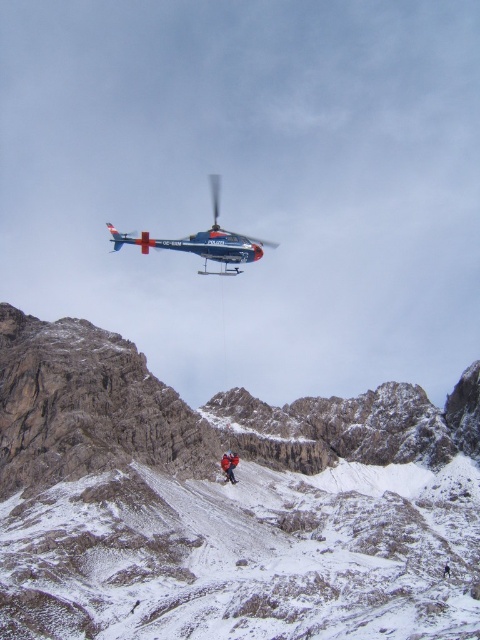
Question: Which point is farther from the camera taking this photo?

Choices:
 (A) (233, 477)
 (B) (238, 262)

Answer: (B)

Question: Which object is the farthest from the snowy rocky mountain at center?

Choices:
 (A) red fabric jacket at center
 (B) polished metallic helicopter at upper center

Answer: (B)

Question: Can you confirm if polished metallic helicopter at upper center is wider than red fabric jacket at center?

Choices:
 (A) yes
 (B) no

Answer: (A)

Question: Which point appears closest to the camera in this image?

Choices:
 (A) (228, 477)
 (B) (237, 580)
 (C) (256, 241)

Answer: (B)

Question: Can you confirm if snowy rocky mountain at center is positioned below red fabric jacket at center?

Choices:
 (A) no
 (B) yes

Answer: (A)

Question: Where is snowy rocky mountain at center located in relation to polished metallic helicopter at upper center in the image?

Choices:
 (A) above
 (B) below

Answer: (B)